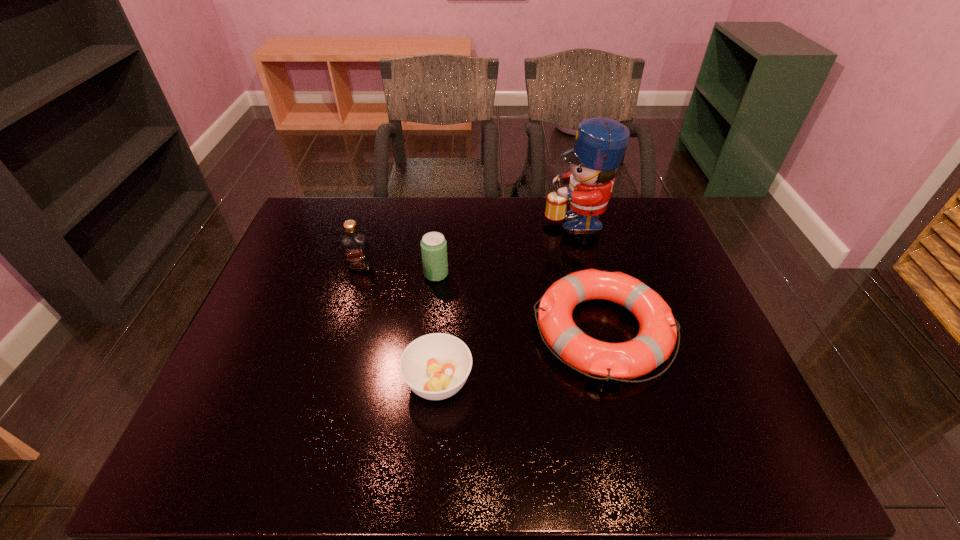
The image size is (960, 540). Identify the location of object that stands as the third closest to the soda. (435, 366).

Identify the location of object that is the fourth closest one to the vodka. This screenshot has height=540, width=960. (600, 143).

Find the location of `free space that satisfies the following two spatial constraints: 1. on the back side of the soup bowl; 2. on the left side of the life buoy`. free space that satisfies the following two spatial constraints: 1. on the back side of the soup bowl; 2. on the left side of the life buoy is located at coordinates (443, 330).

This screenshot has width=960, height=540. Identify the location of free spot that satisfies the following two spatial constraints: 1. on the front-facing side of the soda; 2. on the right side of the vodka. (358, 274).

Locate an element on the screen. Image resolution: width=960 pixels, height=540 pixels. free space that satisfies the following two spatial constraints: 1. on the front-facing side of the fourth shortest object; 2. on the left side of the third tallest object is located at coordinates (358, 274).

Locate an element on the screen. The image size is (960, 540). free space in the image that satisfies the following two spatial constraints: 1. on the front-facing side of the farthest object; 2. on the front-facing side of the fourth shortest object is located at coordinates (588, 267).

The width and height of the screenshot is (960, 540). Find the location of `vacant space that satisfies the following two spatial constraints: 1. on the front-facing side of the tallest object; 2. on the front side of the life buoy`. vacant space that satisfies the following two spatial constraints: 1. on the front-facing side of the tallest object; 2. on the front side of the life buoy is located at coordinates (604, 330).

Find the location of a particular element. This screenshot has height=540, width=960. free spot that satisfies the following two spatial constraints: 1. on the front-facing side of the leftmost object; 2. on the right side of the life buoy is located at coordinates (342, 330).

Where is `free location that satisfies the following two spatial constraints: 1. on the front-facing side of the leftmost object; 2. on the right side of the life buoy`? The width and height of the screenshot is (960, 540). free location that satisfies the following two spatial constraints: 1. on the front-facing side of the leftmost object; 2. on the right side of the life buoy is located at coordinates (342, 330).